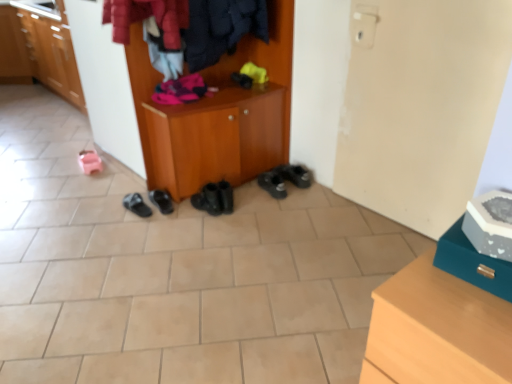
Image resolution: width=512 pixels, height=384 pixels. Find the location of `free space to the right of black rubber shoes at center, the 4th footwear positioned from the right`. free space to the right of black rubber shoes at center, the 4th footwear positioned from the right is located at coordinates (182, 208).